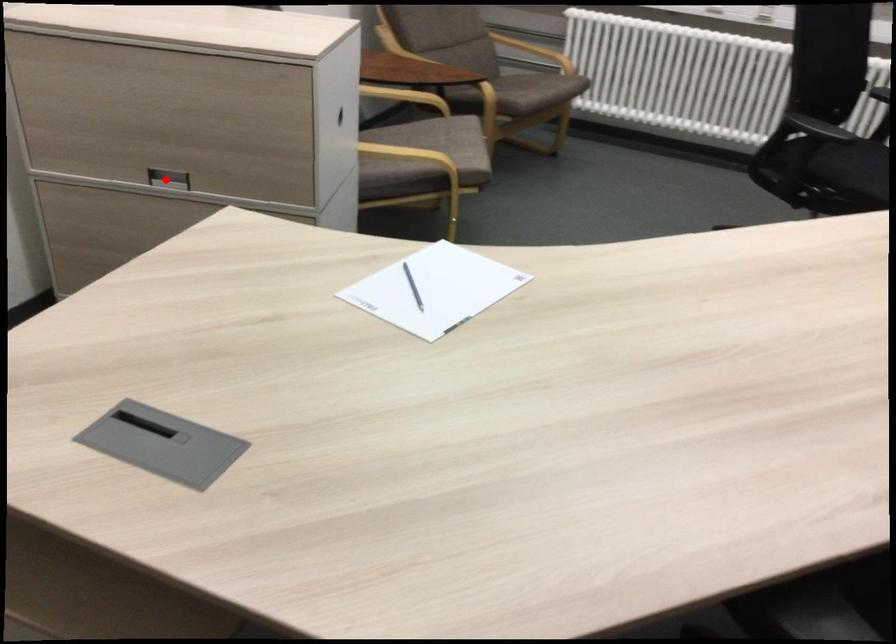
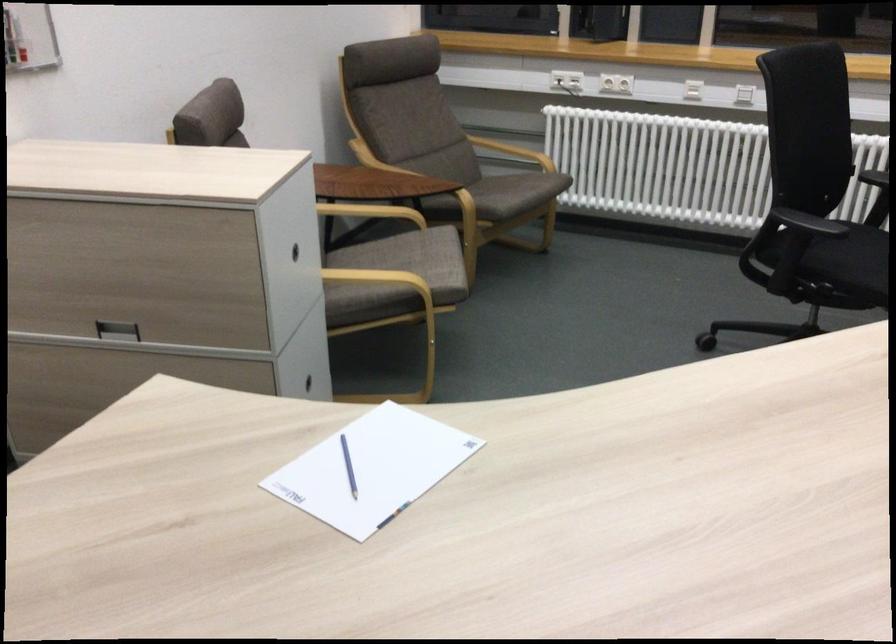
Where in the second image is the point corresponding to the highlighted location from the first image?

(116, 330)